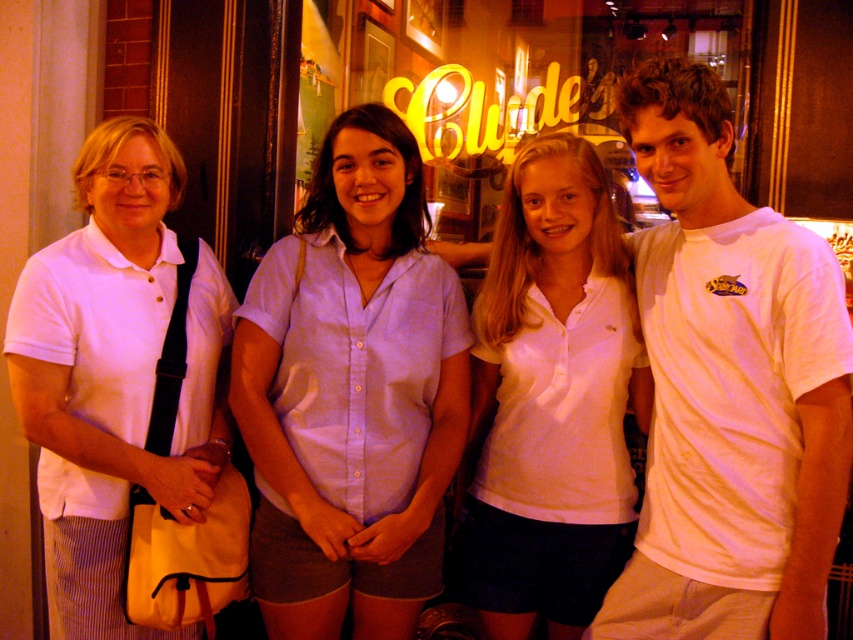
Question: Based on their relative distances, which object is farther from the white matte shirt at left?

Choices:
 (A) white cotton polo shirt at center
 (B) yellow neon sign at upper center
 (C) purple cotton shirt at center
 (D) white cotton t-shirt at right

Answer: (D)

Question: Is white cotton polo shirt at center below yellow neon sign at upper center?

Choices:
 (A) yes
 (B) no

Answer: (A)

Question: Is purple cotton shirt at center positioned behind white matte shirt at left?

Choices:
 (A) no
 (B) yes

Answer: (A)

Question: Estimate the real-world distances between objects in this image. Which object is farther from the white cotton polo shirt at center?

Choices:
 (A) yellow neon sign at upper center
 (B) white matte shirt at left
 (C) purple cotton shirt at center

Answer: (B)

Question: Among these objects, which one is farthest from the camera?

Choices:
 (A) yellow neon sign at upper center
 (B) purple cotton shirt at center
 (C) white cotton polo shirt at center

Answer: (A)

Question: Does purple cotton shirt at center have a lesser width compared to white matte shirt at left?

Choices:
 (A) no
 (B) yes

Answer: (A)